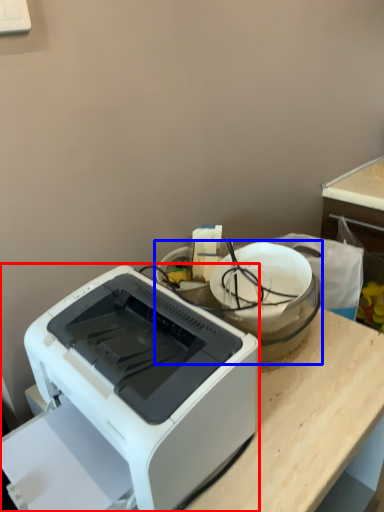
Question: Which of the following is the closest to the observer, printer (highlighted by a red box) or appliance (highlighted by a blue box)?

Choices:
 (A) printer
 (B) appliance

Answer: (A)